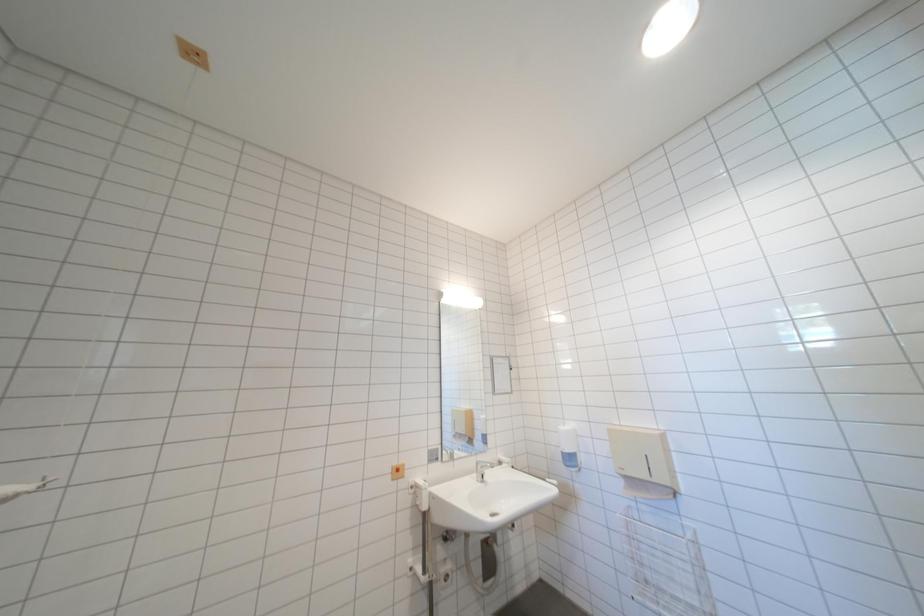
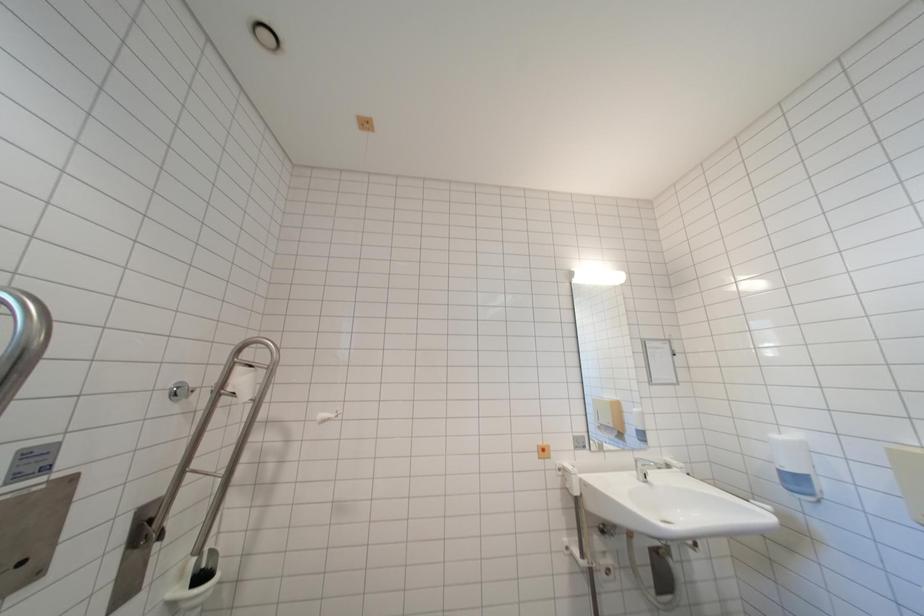
Which direction would the cameraman need to move to produce the second image?

The movement direction of the cameraman is left, backward.